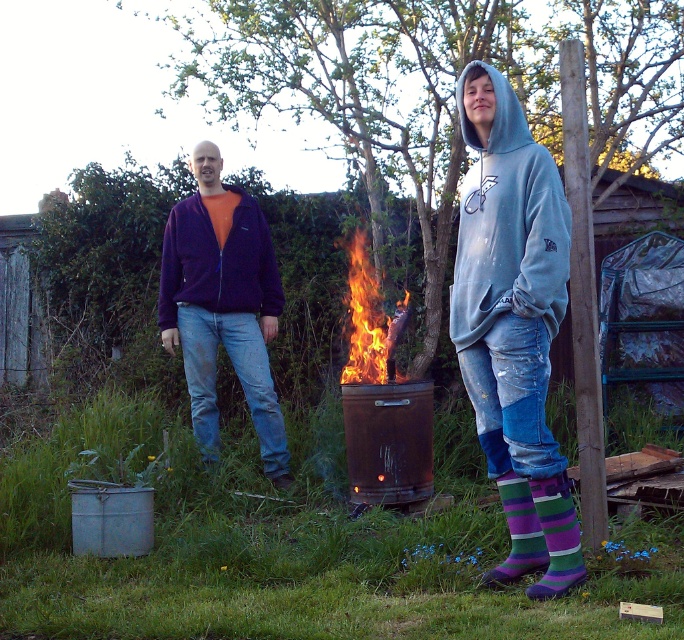
You are a photographer trying to capture the flaming wood at center without the purple fleece jacket at left blocking the view. Can you move closer to the jacket to frame the flame better?

The flaming wood at center is behind the purple fleece jacket at left, so moving closer to the jacket would bring it between you and the flame, worsening the blockage. To avoid obstruction, you should move around the jacket to either side or step back to ensure the flame remains visible beyond the jacket.

Based on the photo, what is the color and material of the clothing item located at point (508, 225) in the image?

The clothing item at point (508, 225) is a light blue cotton hoodie.

You are a photographer trying to capture the two subjects in the scene. The light blue cotton hoodie at center and the purple striped socks at lower right are both in your frame. Based on their positions, which object is closer to the left edge of your photo?

The light blue cotton hoodie at center is closer to the left edge of the photo because it is positioned to the left of the purple striped socks at lower right.